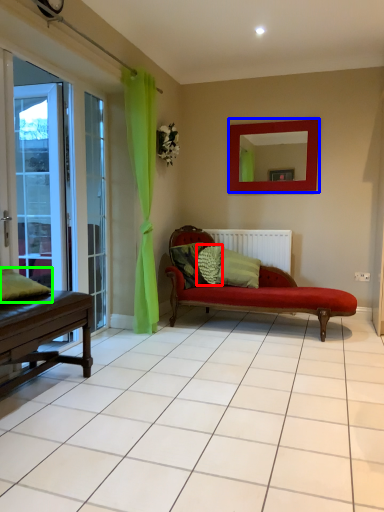
Question: Which object is positioned closest to pillow (highlighted by a red box)? Select from mirror (highlighted by a blue box) and pillow (highlighted by a green box).

Choices:
 (A) mirror
 (B) pillow

Answer: (A)